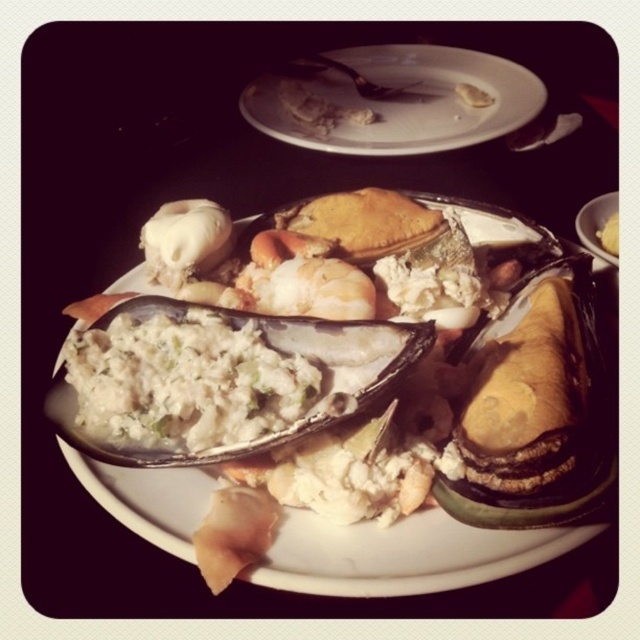
Is point (467, 560) behind point (294, 141)?

No, it is in front of (294, 141).

Locate an element on the screen. The width and height of the screenshot is (640, 640). white creamy seafood at center is located at coordinates (403, 554).

Can you confirm if white porcelain plate at upper center is taller than yellow matte bread at center?

Yes.

Who is more forward, (483, 54) or (605, 244)?

Point (605, 244) is more forward.

Where is `white porcelain plate at upper center`? The height and width of the screenshot is (640, 640). white porcelain plate at upper center is located at coordinates (406, 100).

Which is below, white creamy seafood at center or yellow matte bread at center?

white creamy seafood at center is lower down.

Can you confirm if white creamy seafood at center is bigger than yellow matte bread at center?

Yes.

Does point (348, 580) come closer to viewer compared to point (598, 237)?

Yes, point (348, 580) is closer to viewer.

At what (x,y) coordinates should I click in order to perform the action: click on white creamy seafood at center. Please return your answer as a coordinate pair (x, y). Looking at the image, I should click on (403, 554).